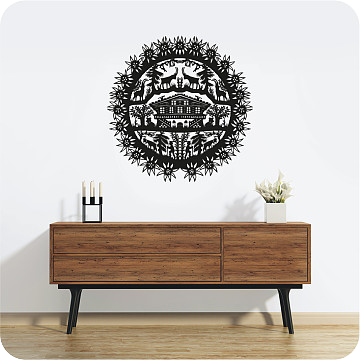
Where is `candles`? This screenshot has height=360, width=360. candles is located at coordinates (90, 186).